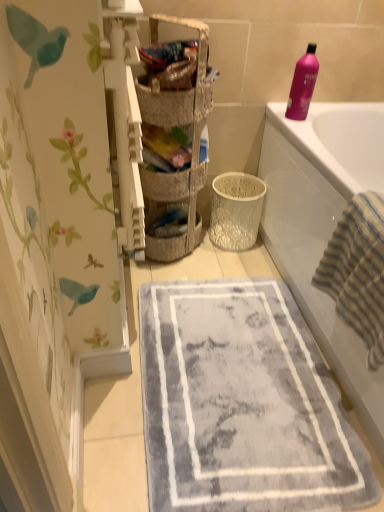
Where is `white glossy bathtub at upper right`? The height and width of the screenshot is (512, 384). white glossy bathtub at upper right is located at coordinates (323, 225).

What is the approximate width of striped cotton beach towel at right?

It is 9.22 inches.

Where is `woven fabric basket at upper center, placed as the second basket when sorted from back to front`? The width and height of the screenshot is (384, 512). woven fabric basket at upper center, placed as the second basket when sorted from back to front is located at coordinates (182, 92).

From a real-world perspective, is woven fabric basket at upper center, arranged as the 1th basket when viewed from the front, positioned above or below pink glossy bottle at upper right?

In terms of real-world spatial position, woven fabric basket at upper center, arranged as the 1th basket when viewed from the front, is above pink glossy bottle at upper right.

Is woven fabric basket at upper center, arranged as the 1th basket when viewed from the front, spatially inside pink glossy bottle at upper right, or outside of it?

woven fabric basket at upper center, arranged as the 1th basket when viewed from the front, lies outside pink glossy bottle at upper right.

Which is closer, (182, 22) or (307, 47)?

The point (182, 22) is in front.

Is woven fabric basket at upper center, arranged as the 1th basket when viewed from the front, far away from pink glossy bottle at upper right?

No, woven fabric basket at upper center, arranged as the 1th basket when viewed from the front, is not far from pink glossy bottle at upper right.

Are woven fabric basket at upper center, placed as the second basket when sorted from back to front, and white glossy bathtub at upper right beside each other?

No, woven fabric basket at upper center, placed as the second basket when sorted from back to front, is not making contact with white glossy bathtub at upper right.

Can you confirm if woven fabric basket at upper center, arranged as the 1th basket when viewed from the front, is wider than white glossy bathtub at upper right?

No, woven fabric basket at upper center, arranged as the 1th basket when viewed from the front, is not wider than white glossy bathtub at upper right.

Which of these two, woven fabric basket at upper center, arranged as the 1th basket when viewed from the front, or white glossy bathtub at upper right, stands taller?

white glossy bathtub at upper right.

Is woven fabric basket at upper center, arranged as the 1th basket when viewed from the front, aimed at white glossy bathtub at upper right?

No, woven fabric basket at upper center, arranged as the 1th basket when viewed from the front, is not facing towards white glossy bathtub at upper right.

Considering their positions, is textured wicker basket at center, which ranks as the 2th basket in front-to-back order, located in front of or behind white glossy bathtub at upper right?

Clearly, textured wicker basket at center, which ranks as the 2th basket in front-to-back order, is behind white glossy bathtub at upper right.

Is white glossy bathtub at upper right a part of textured wicker basket at center, which ranks as the 2th basket in front-to-back order?

Actually, white glossy bathtub at upper right is outside textured wicker basket at center, which ranks as the 2th basket in front-to-back order.

Could you tell me if textured wicker basket at center, placed as the 1th basket when sorted from back to front, is turned towards white glossy bathtub at upper right?

Yes, textured wicker basket at center, placed as the 1th basket when sorted from back to front, faces towards white glossy bathtub at upper right.

Considering the sizes of objects textured wicker basket at center, placed as the 1th basket when sorted from back to front, and white glossy bathtub at upper right in the image provided, who is shorter, textured wicker basket at center, placed as the 1th basket when sorted from back to front, or white glossy bathtub at upper right?

Standing shorter between the two is textured wicker basket at center, placed as the 1th basket when sorted from back to front.

Is woven fabric basket at upper center, placed as the second basket when sorted from back to front, positioned in front of striped cotton beach towel at right?

That is False.

Considering the sizes of objects woven fabric basket at upper center, arranged as the 1th basket when viewed from the front, and striped cotton beach towel at right in the image provided, who is thinner, woven fabric basket at upper center, arranged as the 1th basket when viewed from the front, or striped cotton beach towel at right?

With smaller width is woven fabric basket at upper center, arranged as the 1th basket when viewed from the front.

Is woven fabric basket at upper center, placed as the second basket when sorted from back to front, not close to striped cotton beach towel at right?

They are positioned close to each other.

From a real-world perspective, is woven fabric basket at upper center, arranged as the 1th basket when viewed from the front, under striped cotton beach towel at right?

No, from a real-world perspective, woven fabric basket at upper center, arranged as the 1th basket when viewed from the front, is not below striped cotton beach towel at right.

From the image's perspective, which is below, pink glossy bottle at upper right or white glossy bathtub at upper right?

white glossy bathtub at upper right.

Is pink glossy bottle at upper right bigger or smaller than white glossy bathtub at upper right?

In the image, pink glossy bottle at upper right appears to be smaller than white glossy bathtub at upper right.

Does pink glossy bottle at upper right appear on the right side of white glossy bathtub at upper right?

No, pink glossy bottle at upper right is not to the right of white glossy bathtub at upper right.

From a real-world perspective, which object rests below the other?

striped cotton beach towel at right.

Considering the relative sizes of striped cotton beach towel at right and woven fabric basket at upper center, placed as the second basket when sorted from back to front, in the image provided, is striped cotton beach towel at right taller than woven fabric basket at upper center, placed as the second basket when sorted from back to front,?

Yes.

In terms of width, does striped cotton beach towel at right look wider or thinner when compared to woven fabric basket at upper center, placed as the second basket when sorted from back to front?

Considering their sizes, striped cotton beach towel at right looks broader than woven fabric basket at upper center, placed as the second basket when sorted from back to front.

From a real-world perspective, which basket is the 2nd one above the striped cotton beach towel at right? Please provide its 2D coordinates.

[(182, 92)]

Between pink glossy bottle at upper right and woven basket at center, which one is positioned in front?

woven basket at center is closer to the camera.

Can you confirm if pink glossy bottle at upper right is wider than woven basket at center?

Incorrect, the width of pink glossy bottle at upper right does not surpass that of woven basket at center.

Is pink glossy bottle at upper right not within woven basket at center?

Yes, pink glossy bottle at upper right is not within woven basket at center.

From a real-world perspective, which is physically above, pink glossy bottle at upper right or woven basket at center?

pink glossy bottle at upper right, from a real-world perspective.

Identify the location of cleaning product on the right side of woven fabric basket at upper center, placed as the second basket when sorted from back to front. (303, 85).

Find the location of a particular element. bathtub lying in front of the woven fabric basket at upper center, placed as the second basket when sorted from back to front is located at coordinates pos(323,225).

From the image, which object appears to be nearer to woven fabric basket at upper center, placed as the second basket when sorted from back to front, striped cotton beach towel at right or textured wicker basket at center, which ranks as the 2th basket in front-to-back order?

textured wicker basket at center, which ranks as the 2th basket in front-to-back order, is positioned closer to the anchor woven fabric basket at upper center, placed as the second basket when sorted from back to front.

Considering their positions, is striped cotton beach towel at right positioned further to woven basket at center than woven fabric basket at upper center, arranged as the 1th basket when viewed from the front?

Based on the image, striped cotton beach towel at right appears to be further to woven basket at center.

From the image, which object appears to be farther from striped cotton beach towel at right, pink glossy bottle at upper right or woven basket at center?

woven basket at center is positioned further to the anchor striped cotton beach towel at right.

Based on their spatial positions, is textured wicker basket at center, placed as the 1th basket when sorted from back to front, or woven fabric basket at upper center, placed as the second basket when sorted from back to front, closer to woven basket at center?

textured wicker basket at center, placed as the 1th basket when sorted from back to front, is positioned closer to the anchor woven basket at center.

From the image, which object appears to be nearer to woven basket at center, white glossy bathtub at upper right or gray plush bath mat at center?

white glossy bathtub at upper right is closer to woven basket at center.

When comparing their distances from white glossy bathtub at upper right, does gray plush bath mat at center or textured wicker basket at center, placed as the 1th basket when sorted from back to front, seem further?

textured wicker basket at center, placed as the 1th basket when sorted from back to front, is positioned further to the anchor white glossy bathtub at upper right.

Looking at the image, which one is located closer to woven fabric basket at upper center, placed as the second basket when sorted from back to front, pink glossy bottle at upper right or white glossy bathtub at upper right?

Based on the image, pink glossy bottle at upper right appears to be nearer to woven fabric basket at upper center, placed as the second basket when sorted from back to front.

From the picture: Based on their spatial positions, is striped cotton beach towel at right or woven basket at center further from white glossy bathtub at upper right?

Based on the image, woven basket at center appears to be further to white glossy bathtub at upper right.

Where is `basket between woven basket at center and white glossy bathtub at upper right from left to right`? Image resolution: width=384 pixels, height=512 pixels. basket between woven basket at center and white glossy bathtub at upper right from left to right is located at coordinates (182, 92).

You are a GUI agent. You are given a task and a screenshot of the screen. Output one action in this format:
    pyautogui.click(x=<x>, y=<y>)
    Task: Click on the shelf that lies between pink glossy bottle at upper right and striped cotton beach towel at right from top to bottom
    
    Given the screenshot: What is the action you would take?
    pyautogui.click(x=192, y=145)

This screenshot has width=384, height=512. Identify the location of shelf situated between textured wicker basket at center, which ranks as the 2th basket in front-to-back order, and white glossy bathtub at upper right from left to right. click(192, 145).

This screenshot has height=512, width=384. What are the coordinates of `bath mat between woven basket at center and white glossy bathtub at upper right from left to right` in the screenshot? It's located at (242, 404).